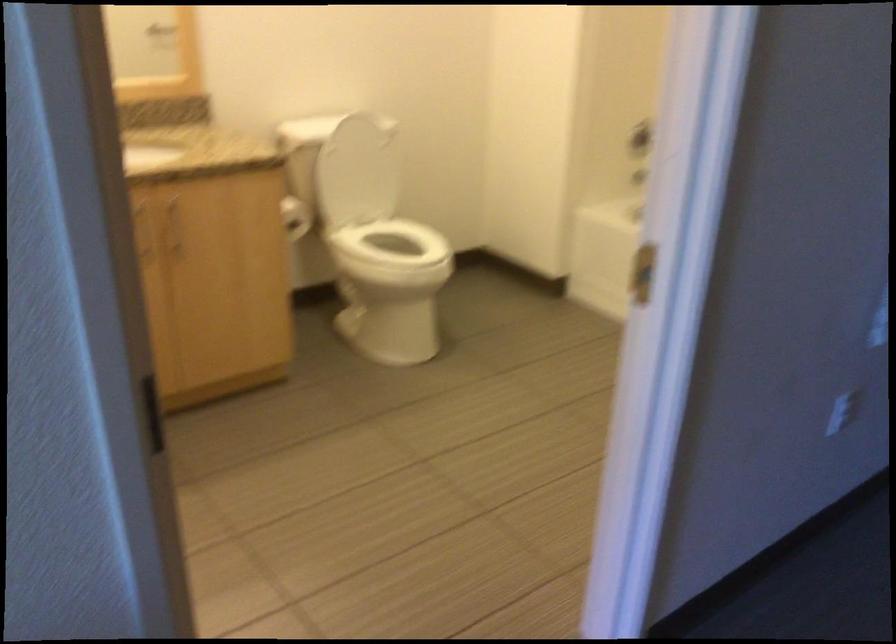
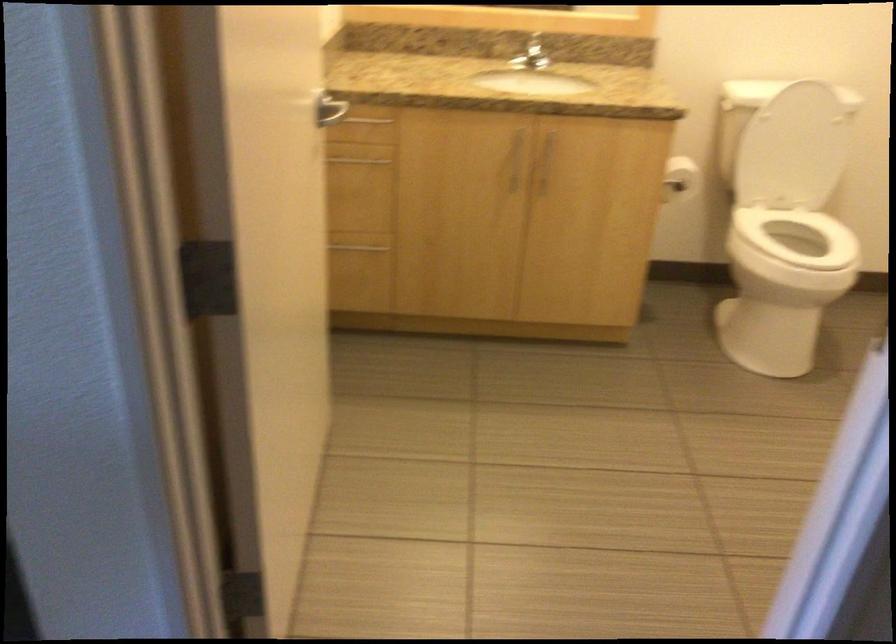
Find the pixel in the second image that matches the point at 149,228 in the first image.

(518, 158)